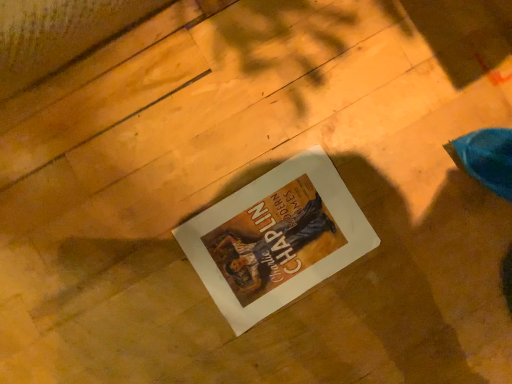
The image size is (512, 384). What do you see at coordinates (276, 238) in the screenshot? I see `matte paper poster at center` at bounding box center [276, 238].

At what (x,y) coordinates should I click in order to perform the action: click on matte paper poster at center. Please return your answer as a coordinate pair (x, y). Looking at the image, I should click on (276, 238).

Locate an element on the screen. This screenshot has width=512, height=384. matte paper poster at center is located at coordinates (276, 238).